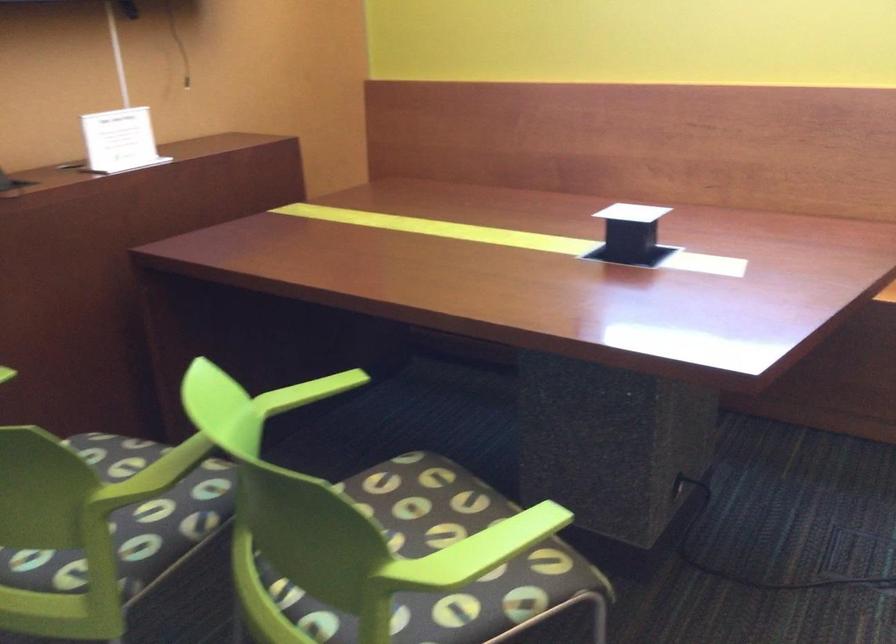
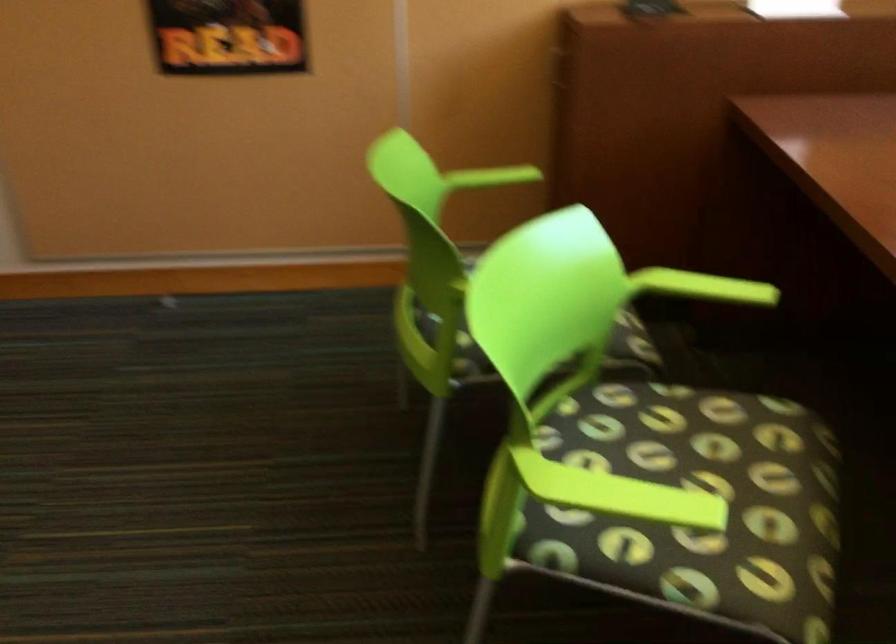
The point at (433, 529) is marked in the first image. Where is the corresponding point in the second image?

(708, 482)